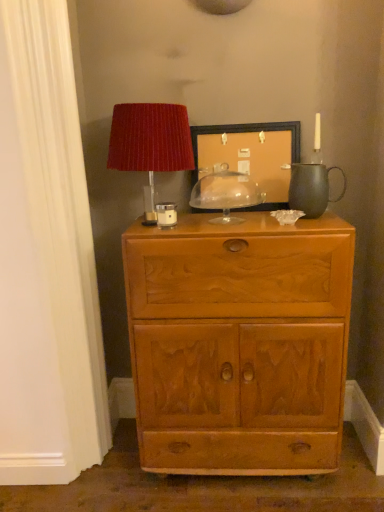
You are a GUI agent. You are given a task and a screenshot of the screen. Output one action in this format:
    pyautogui.click(x=<x>, y=<y>)
    Task: Click on the wooden picture frame at center
    The height and width of the screenshot is (512, 384).
    Given the screenshot: What is the action you would take?
    pyautogui.click(x=251, y=155)

What do you see at coordinates (251, 155) in the screenshot? The image size is (384, 512). I see `wooden picture frame at center` at bounding box center [251, 155].

At what (x,y) coordinates should I click in order to perform the action: click on matte white candle holder at upper center, placed as the 1th candle holder when sorted from left to right. Please return your answer as a coordinate pair (x, y). Looking at the image, I should click on (166, 214).

Find the location of `light brown wood chest of drawers at center`. light brown wood chest of drawers at center is located at coordinates (239, 344).

What is the approximate height of clear glass dome at center, arranged as the 1th candle holder when viewed from the right?

A: The height of clear glass dome at center, arranged as the 1th candle holder when viewed from the right, is 9.61 inches.

The image size is (384, 512). What do you see at coordinates (311, 188) in the screenshot?
I see `matte black teapot at right` at bounding box center [311, 188].

Image resolution: width=384 pixels, height=512 pixels. What do you see at coordinates (150, 139) in the screenshot? I see `matte red lampshade at upper left` at bounding box center [150, 139].

Measure the distance between matte red lampshade at upper left and camera.

The depth of matte red lampshade at upper left is 5.07 feet.

In order to click on wooden picture frame at center in this screenshot , I will do `click(251, 155)`.

From the image's perspective, which one is positioned higher, clear glass dome at center, arranged as the 1th candle holder when viewed from the right, or matte black teapot at right?

From the image's view, matte black teapot at right is above.

Which is behind, point (206, 195) or point (304, 170)?

The point (206, 195) is more distant.

Considering the relative sizes of clear glass dome at center, arranged as the 1th candle holder when viewed from the right, and matte black teapot at right in the image provided, is clear glass dome at center, arranged as the 1th candle holder when viewed from the right, wider than matte black teapot at right?

Yes.

Looking at this image, relative to matte black teapot at right, is clear glass dome at center, which appears as the 2th candle holder when viewed from the front, in front or behind?

Visually, clear glass dome at center, which appears as the 2th candle holder when viewed from the front, is located behind matte black teapot at right.

Is wooden picture frame at center far away from light brown wood chest of drawers at center?

They are positioned close to each other.

The height and width of the screenshot is (512, 384). In order to click on the chest of drawers below the wooden picture frame at center (from a real-world perspective) in this screenshot , I will do `click(239, 344)`.

Considering their positions, is wooden picture frame at center located in front of or behind light brown wood chest of drawers at center?

wooden picture frame at center is behind light brown wood chest of drawers at center.

From the image's perspective, is light brown wood chest of drawers at center located above or below matte red lampshade at upper left?

light brown wood chest of drawers at center is situated lower than matte red lampshade at upper left in the image.

Does light brown wood chest of drawers at center lie behind matte red lampshade at upper left?

No, light brown wood chest of drawers at center is closer to the viewer.

Is light brown wood chest of drawers at center positioned with its back to matte red lampshade at upper left?

No, light brown wood chest of drawers at center's orientation is not away from matte red lampshade at upper left.

Between light brown wood chest of drawers at center and matte red lampshade at upper left, which one has less height?

With less height is matte red lampshade at upper left.

At what (x,y) coordinates should I click in order to perform the action: click on tea pot on the right of the clear glass dome at center, arranged as the 1th candle holder when viewed from the right. Please return your answer as a coordinate pair (x, y). Looking at the image, I should click on (311, 188).

Which object is thinner, matte black teapot at right or clear glass dome at center, arranged as the 1th candle holder when viewed from the right?

matte black teapot at right is thinner.

Does matte black teapot at right lie behind clear glass dome at center, which appears as the first candle holder when viewed from the back?

No, it is in front of clear glass dome at center, which appears as the first candle holder when viewed from the back.

Based on their positions, is matte black teapot at right located to the left or right of clear glass dome at center, which appears as the 2th candle holder when viewed from the front?

matte black teapot at right is to the right of clear glass dome at center, which appears as the 2th candle holder when viewed from the front.

From the image's perspective, which one is positioned higher, light brown wood chest of drawers at center or clear glass dome at center, positioned as the 2th candle holder in left-to-right order?

From the image's view, clear glass dome at center, positioned as the 2th candle holder in left-to-right order, is above.

Could you tell me if light brown wood chest of drawers at center is turned towards clear glass dome at center, which appears as the first candle holder when viewed from the back?

No, light brown wood chest of drawers at center is not aimed at clear glass dome at center, which appears as the first candle holder when viewed from the back.

Is the depth of light brown wood chest of drawers at center greater than that of clear glass dome at center, which appears as the 2th candle holder when viewed from the front?

No, it is in front of clear glass dome at center, which appears as the 2th candle holder when viewed from the front.

Is clear glass dome at center, arranged as the 1th candle holder when viewed from the right, completely or partially inside light brown wood chest of drawers at center?

No, clear glass dome at center, arranged as the 1th candle holder when viewed from the right, is not a part of light brown wood chest of drawers at center.

Is light brown wood chest of drawers at center aimed at matte white candle holder at upper center, placed as the 1th candle holder when sorted from left to right?

No, light brown wood chest of drawers at center is not turned towards matte white candle holder at upper center, placed as the 1th candle holder when sorted from left to right.

Does light brown wood chest of drawers at center have a greater width compared to matte white candle holder at upper center, the 2th candle holder from the back?

Indeed, light brown wood chest of drawers at center has a greater width compared to matte white candle holder at upper center, the 2th candle holder from the back.

Is light brown wood chest of drawers at center further to the viewer compared to matte white candle holder at upper center, the 2th candle holder from the back?

No, it is not.

In the scene shown: Who is smaller, light brown wood chest of drawers at center or matte white candle holder at upper center, placed as the 1th candle holder when sorted from left to right?

With smaller size is matte white candle holder at upper center, placed as the 1th candle holder when sorted from left to right.

Consider the image. Which object is closer to the camera, wooden picture frame at center or clear glass dome at center, which appears as the first candle holder when viewed from the back?

clear glass dome at center, which appears as the first candle holder when viewed from the back, is more forward.

Is wooden picture frame at center inside the boundaries of clear glass dome at center, arranged as the 1th candle holder when viewed from the right, or outside?

wooden picture frame at center lies outside clear glass dome at center, arranged as the 1th candle holder when viewed from the right.

Is wooden picture frame at center looking in the opposite direction of clear glass dome at center, which appears as the first candle holder when viewed from the back?

Absolutely, wooden picture frame at center is directed away from clear glass dome at center, which appears as the first candle holder when viewed from the back.

Is wooden picture frame at center taller than clear glass dome at center, which appears as the first candle holder when viewed from the back?

Correct, wooden picture frame at center is much taller as clear glass dome at center, which appears as the first candle holder when viewed from the back.

Image resolution: width=384 pixels, height=512 pixels. Find the location of `tea pot above the clear glass dome at center, which appears as the 2th candle holder when viewed from the front (from a real-world perspective)`. tea pot above the clear glass dome at center, which appears as the 2th candle holder when viewed from the front (from a real-world perspective) is located at coordinates (311, 188).

This screenshot has width=384, height=512. Identify the location of picture frame above the light brown wood chest of drawers at center (from the image's perspective). (251, 155).

Based on their spatial positions, is matte black teapot at right or matte white candle holder at upper center, the first candle holder in the front-to-back sequence, closer to clear glass dome at center, arranged as the 1th candle holder when viewed from the right?

Based on the image, matte white candle holder at upper center, the first candle holder in the front-to-back sequence, appears to be nearer to clear glass dome at center, arranged as the 1th candle holder when viewed from the right.

Looking at the image, which one is located closer to matte black teapot at right, clear glass dome at center, positioned as the 2th candle holder in left-to-right order, or light brown wood chest of drawers at center?

clear glass dome at center, positioned as the 2th candle holder in left-to-right order.

When comparing their distances from matte red lampshade at upper left, does clear glass dome at center, positioned as the 2th candle holder in left-to-right order, or wooden picture frame at center seem further?

clear glass dome at center, positioned as the 2th candle holder in left-to-right order, lies further to matte red lampshade at upper left than the other object.

From the picture: Considering their positions, is wooden picture frame at center positioned closer to matte red lampshade at upper left than light brown wood chest of drawers at center?

Based on the image, wooden picture frame at center appears to be nearer to matte red lampshade at upper left.

From the image, which object appears to be nearer to light brown wood chest of drawers at center, clear glass dome at center, which appears as the 2th candle holder when viewed from the front, or matte red lampshade at upper left?

clear glass dome at center, which appears as the 2th candle holder when viewed from the front, is closer to light brown wood chest of drawers at center.

From the image, which object appears to be farther from clear glass dome at center, which appears as the 2th candle holder when viewed from the front, matte black teapot at right or wooden picture frame at center?

matte black teapot at right is positioned further to the anchor clear glass dome at center, which appears as the 2th candle holder when viewed from the front.

Considering their positions, is matte black teapot at right positioned closer to matte white candle holder at upper center, placed as the 1th candle holder when sorted from left to right, than light brown wood chest of drawers at center?

Among the two, matte black teapot at right is located nearer to matte white candle holder at upper center, placed as the 1th candle holder when sorted from left to right.

Considering their positions, is wooden picture frame at center positioned further to clear glass dome at center, which appears as the 2th candle holder when viewed from the front, than matte white candle holder at upper center, the 2th candle holder from the right?

matte white candle holder at upper center, the 2th candle holder from the right, is positioned further to the anchor clear glass dome at center, which appears as the 2th candle holder when viewed from the front.

Image resolution: width=384 pixels, height=512 pixels. In order to click on candle holder between clear glass dome at center, arranged as the 1th candle holder when viewed from the right, and light brown wood chest of drawers at center vertically in this screenshot , I will do `click(166, 214)`.

The image size is (384, 512). Find the location of `candle holder situated between matte red lampshade at upper left and clear glass dome at center, positioned as the 2th candle holder in left-to-right order, from left to right`. candle holder situated between matte red lampshade at upper left and clear glass dome at center, positioned as the 2th candle holder in left-to-right order, from left to right is located at coordinates (166, 214).

Image resolution: width=384 pixels, height=512 pixels. In order to click on candle holder between matte white candle holder at upper center, the 2th candle holder from the right, and matte black teapot at right in this screenshot , I will do `click(226, 194)`.

I want to click on picture frame between matte red lampshade at upper left and matte black teapot at right from left to right, so click(x=251, y=155).